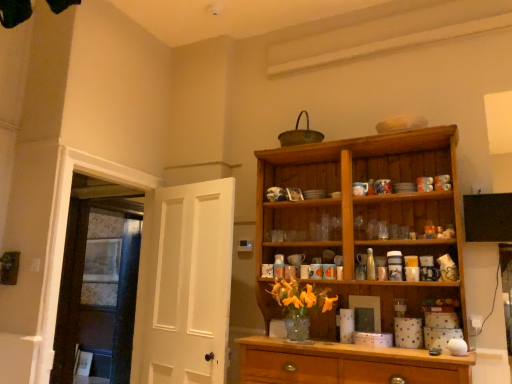
Question: Considering the relative sizes of wooden cabinet at right and white matte door at left, the first door when ordered from front to back, in the image provided, is wooden cabinet at right taller than white matte door at left, the first door when ordered from front to back,?

Choices:
 (A) yes
 (B) no

Answer: (A)

Question: From the image's perspective, is wooden cabinet at right on white matte door at left, the first door when ordered from front to back?

Choices:
 (A) no
 (B) yes

Answer: (B)

Question: From the image's perspective, does wooden cabinet at right appear lower than white matte door at left, marked as the 2th door in a left-to-right arrangement?

Choices:
 (A) yes
 (B) no

Answer: (B)

Question: Considering the relative positions of wooden cabinet at right and white matte door at left, marked as the second door in a back-to-front arrangement, in the image provided, is wooden cabinet at right to the left of white matte door at left, marked as the second door in a back-to-front arrangement, from the viewer's perspective?

Choices:
 (A) no
 (B) yes

Answer: (A)

Question: Is the depth of wooden cabinet at right greater than that of white matte door at left, marked as the 2th door in a left-to-right arrangement?

Choices:
 (A) no
 (B) yes

Answer: (A)

Question: Is wooden cabinet at right not within white matte door at left, the first door when ordered from front to back?

Choices:
 (A) yes
 (B) no

Answer: (A)

Question: Does wooden cabinet at right lie in front of white wooden door at left, marked as the second door in a right-to-left arrangement?

Choices:
 (A) no
 (B) yes

Answer: (B)

Question: Is wooden cabinet at right aimed at white wooden door at left, which is counted as the 1th door, starting from the back?

Choices:
 (A) no
 (B) yes

Answer: (A)

Question: Is wooden cabinet at right thinner than white wooden door at left, acting as the first door starting from the left?

Choices:
 (A) no
 (B) yes

Answer: (A)

Question: From a real-world perspective, is wooden cabinet at right located beneath white wooden door at left, which appears as the 2th door when viewed from the front?

Choices:
 (A) no
 (B) yes

Answer: (A)

Question: From the image's perspective, is wooden cabinet at right on top of white wooden door at left, which appears as the 2th door when viewed from the front?

Choices:
 (A) yes
 (B) no

Answer: (A)

Question: Considering the relative sizes of wooden cabinet at right and white wooden door at left, marked as the second door in a right-to-left arrangement, in the image provided, is wooden cabinet at right bigger than white wooden door at left, marked as the second door in a right-to-left arrangement,?

Choices:
 (A) no
 (B) yes

Answer: (B)

Question: Does white matte door at left, the first door in the right-to-left sequence, lie behind white wooden door at left, which appears as the 2th door when viewed from the front?

Choices:
 (A) no
 (B) yes

Answer: (A)